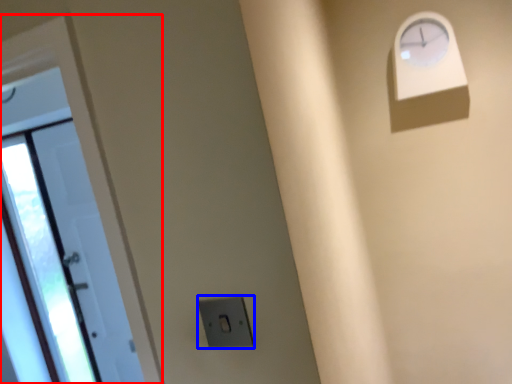
Question: Which of the following is the farthest to the observer, door (highlighted by a red box) or electric outlet (highlighted by a blue box)?

Choices:
 (A) door
 (B) electric outlet

Answer: (A)